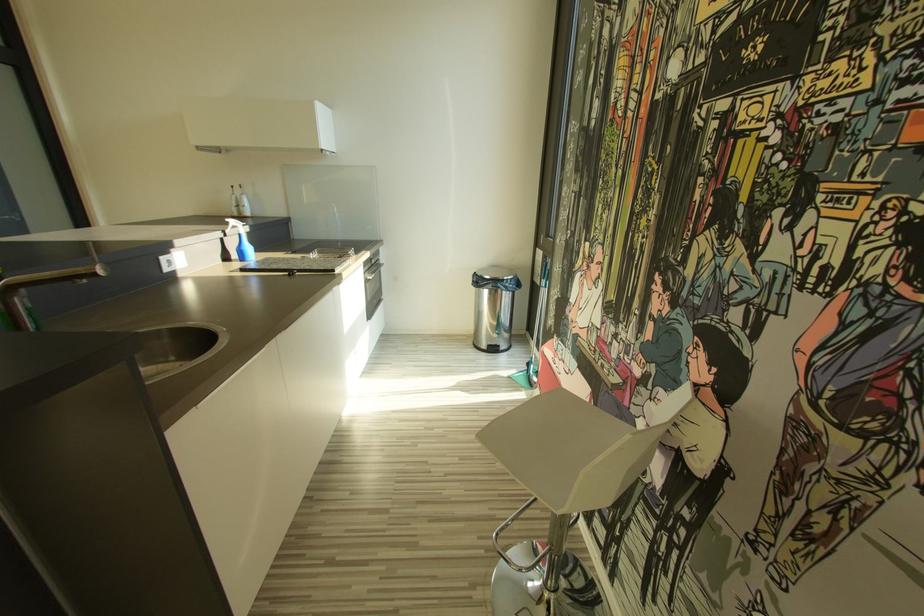
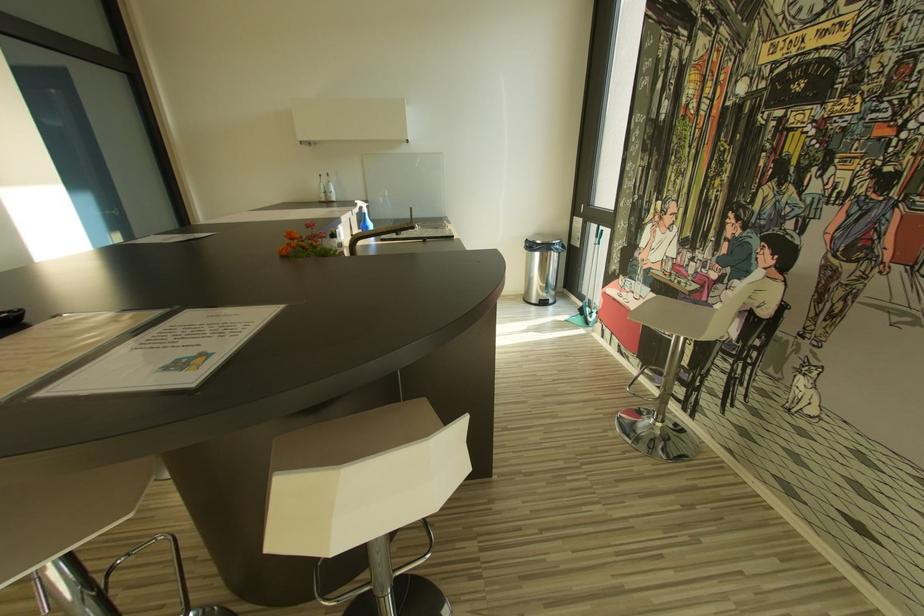
Which direction would the cameraman need to move to produce the second image?

The cameraman moved toward left, backward.